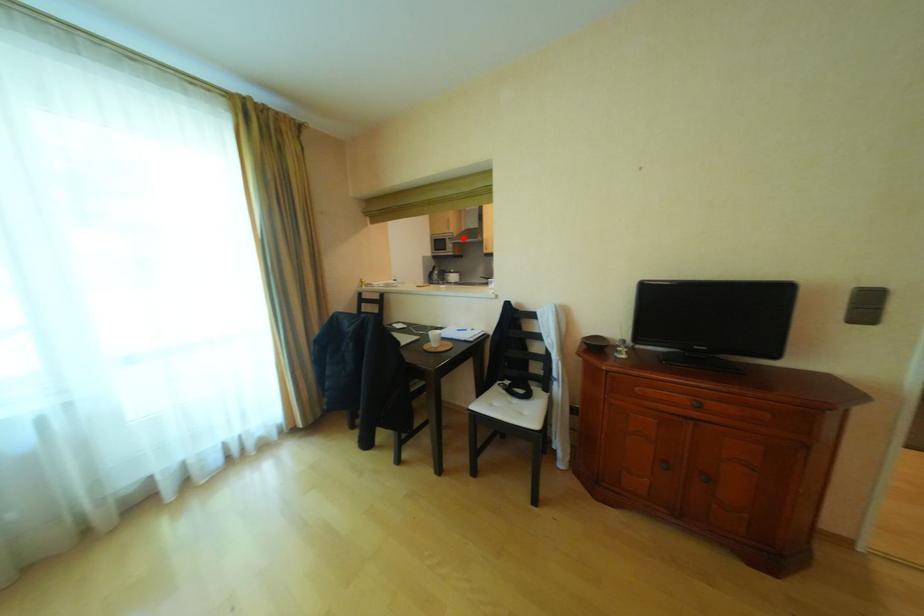
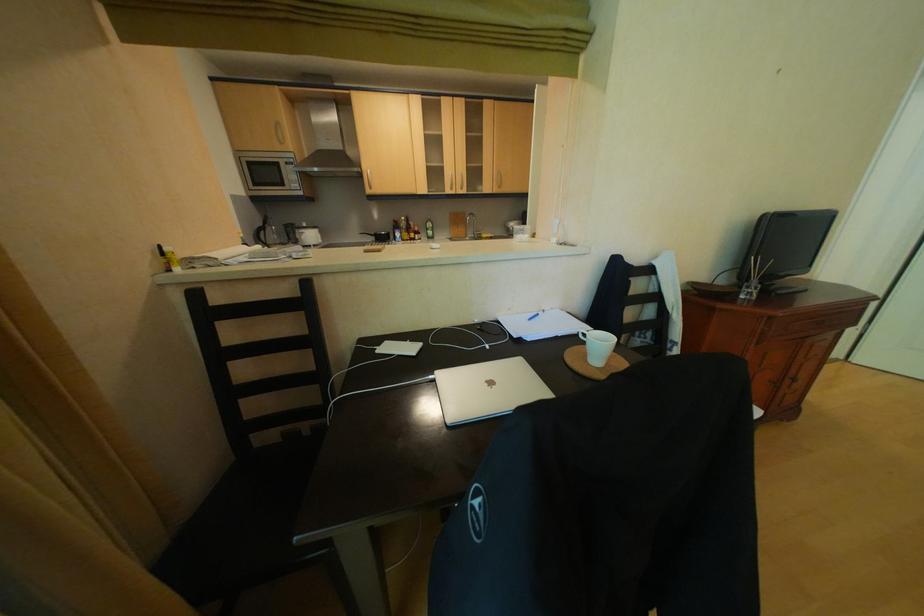
Question: I am providing you with two images of the same scene from different viewpoints. Image1 has a red point marked. In image2, the corresponding 3D location appears at what relative position? Reply with the corresponding letter.

Choices:
 (A) Closer
 (B) Farther

Answer: (B)